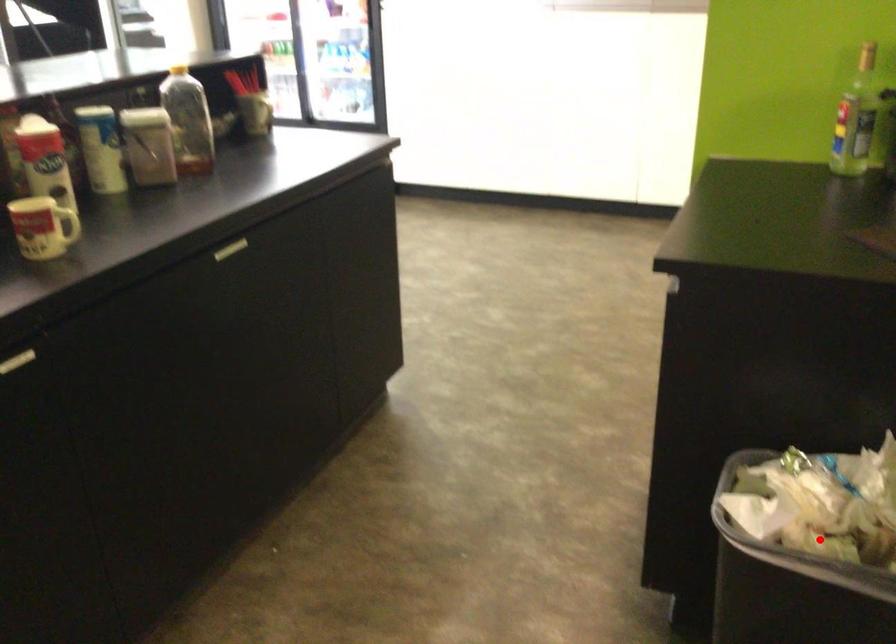
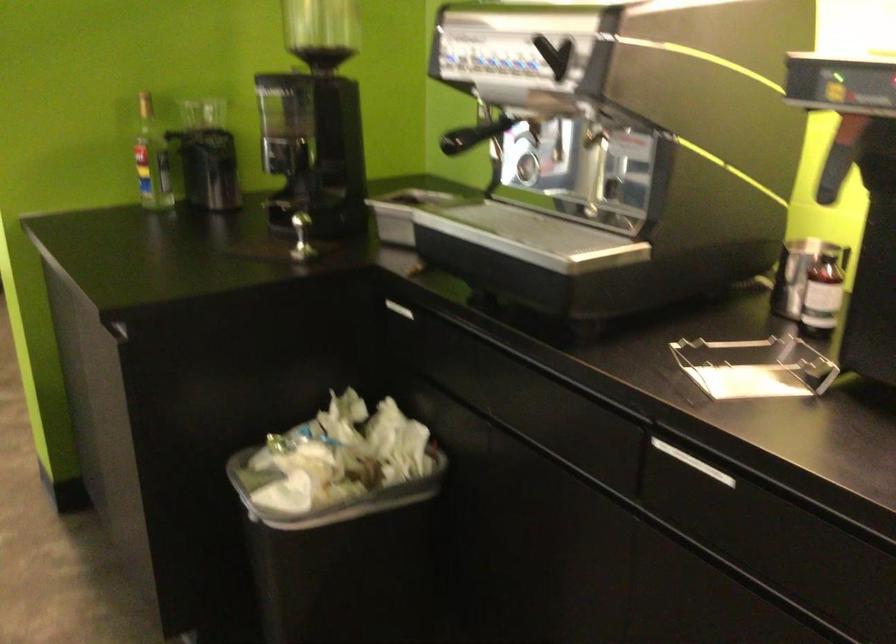
In the second image, find the point that corresponds to the highlighted location in the first image.

(328, 495)